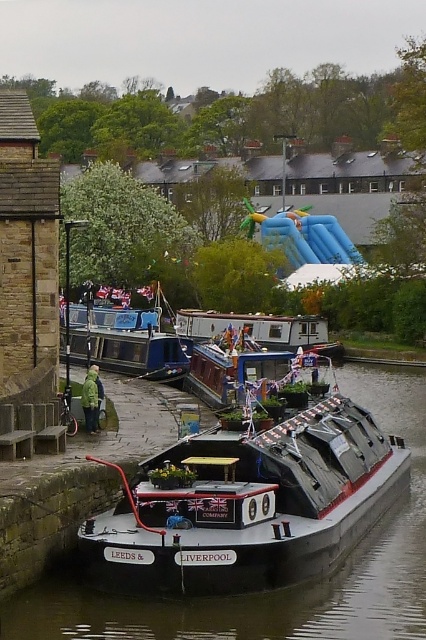
Does point (340, 252) come farther from viewer compared to point (89, 396)?

Yes.

Which is more to the right, blue rubber slide at upper center or green matte jacket at lower left?

Positioned to the right is blue rubber slide at upper center.

Locate an element on the screen. blue rubber slide at upper center is located at coordinates (307, 237).

In order to click on blue rubber slide at upper center in this screenshot , I will do `click(307, 237)`.

Does wooden polished boat at center lie in front of green matte jacket at lower left?

Yes, it is.

Can you confirm if wooden polished boat at center is bigger than green matte jacket at lower left?

Correct, wooden polished boat at center is larger in size than green matte jacket at lower left.

Where is `wooden polished boat at center`? The width and height of the screenshot is (426, 640). wooden polished boat at center is located at coordinates (236, 368).

You are a GUI agent. You are given a task and a screenshot of the screen. Output one action in this format:
    pyautogui.click(x=<x>, y=<y>)
    Task: Click on the wooden polished boat at center
    Image resolution: width=426 pixels, height=640 pixels.
    Given the screenshot: What is the action you would take?
    pyautogui.click(x=236, y=368)

What do you see at coordinates (249, 504) in the screenshot? The width and height of the screenshot is (426, 640). I see `black polished barge at center` at bounding box center [249, 504].

Who is taller, black polished barge at center or blue rubber slide at upper center?

blue rubber slide at upper center

Does point (348, 410) lie behind point (311, 234)?

No, (348, 410) is closer to viewer.

This screenshot has height=640, width=426. I want to click on black polished barge at center, so [x=249, y=504].